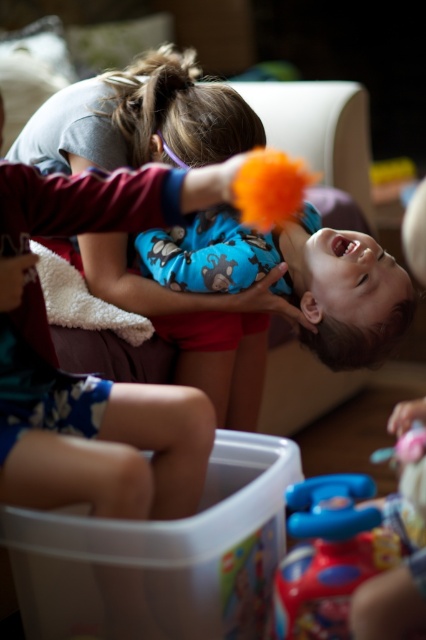
Question: Which of the following is the farthest from the observer?

Choices:
 (A) matte gray shirt at upper left
 (B) rubberized plastic toy at lower right

Answer: (A)

Question: From the image, what is the correct spatial relationship of matte gray shirt at upper left in relation to rubberized plastic toy at lower right?

Choices:
 (A) above
 (B) below

Answer: (A)

Question: Can you confirm if matte gray shirt at upper left is smaller than rubberized plastic toy at lower right?

Choices:
 (A) no
 (B) yes

Answer: (A)

Question: Which point is closer to the camera?

Choices:
 (A) rubberized plastic toy at lower right
 (B) matte gray shirt at upper left

Answer: (A)

Question: Is matte gray shirt at upper left further to the viewer compared to rubberized plastic toy at lower right?

Choices:
 (A) no
 (B) yes

Answer: (B)